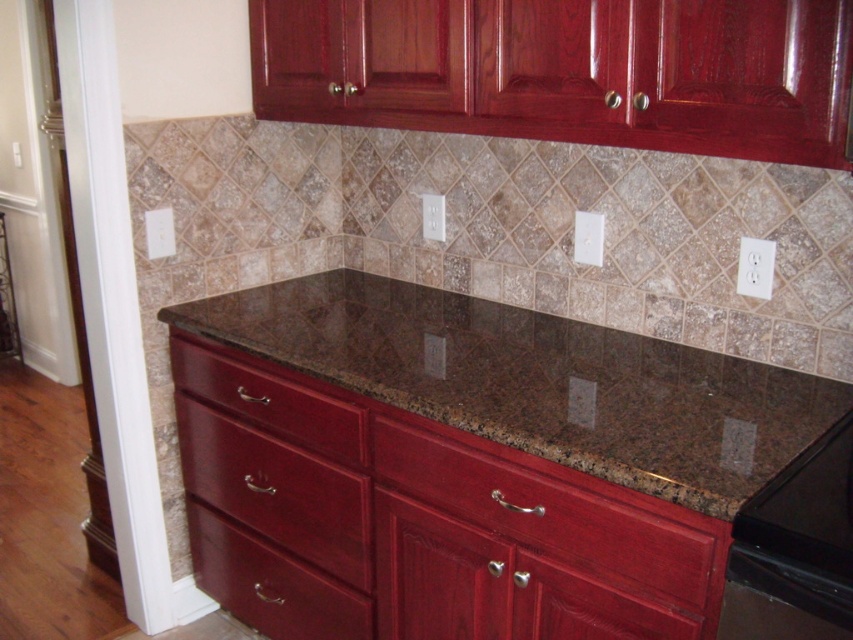
Who is higher up, glossy wood cabinets at upper center or glossy wood drawer at lower center?

glossy wood cabinets at upper center is higher up.

Does glossy wood cabinets at upper center have a larger size compared to glossy wood drawer at lower center?

Yes, glossy wood cabinets at upper center is bigger than glossy wood drawer at lower center.

The height and width of the screenshot is (640, 853). What do you see at coordinates (567, 70) in the screenshot? I see `glossy wood cabinets at upper center` at bounding box center [567, 70].

This screenshot has width=853, height=640. Find the location of `glossy wood cabinets at upper center`. glossy wood cabinets at upper center is located at coordinates (567, 70).

Between glossy wood drawer at lower left and glossy wood drawer at lower center, which one appears on the left side from the viewer's perspective?

glossy wood drawer at lower center is more to the left.

Between glossy wood drawer at lower left and glossy wood drawer at lower center, which one is positioned higher?

Positioned higher is glossy wood drawer at lower left.

At what (x,y) coordinates should I click in order to perform the action: click on glossy wood drawer at lower left. Please return your answer as a coordinate pair (x, y). The width and height of the screenshot is (853, 640). Looking at the image, I should click on (277, 490).

Is point (457, 308) more distant than point (242, 541)?

Yes.

How distant is brown granite countertop at center from glossy wood drawer at lower center?

They are 26.05 inches apart.

Is point (735, 483) farther from camera compared to point (370, 604)?

No, it is in front of (370, 604).

The width and height of the screenshot is (853, 640). I want to click on brown granite countertop at center, so click(537, 381).